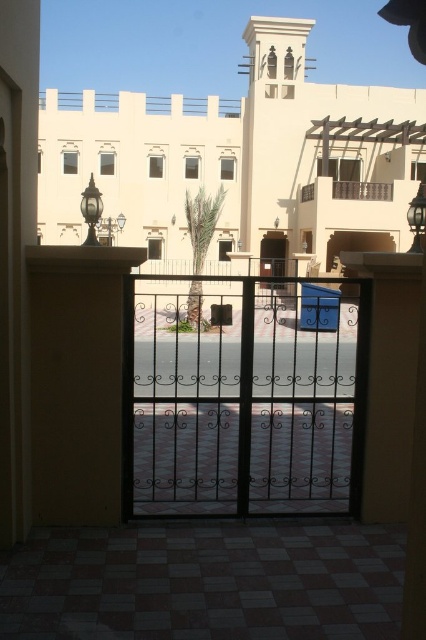
Question: Considering the real-world distances, which object is closest to the black wrought iron gate at center?

Choices:
 (A) clear glass screen door at center
 (B) wooden slats balcony at upper center

Answer: (B)

Question: Which object is closer to the camera taking this photo?

Choices:
 (A) clear glass screen door at center
 (B) wooden slats balcony at upper center
 (C) black wrought iron gate at center

Answer: (C)

Question: Which point appears farthest from the camera in this image?

Choices:
 (A) (388, 186)
 (B) (302, 404)

Answer: (A)

Question: Is black wrought iron gate at center closer to the viewer compared to clear glass screen door at center?

Choices:
 (A) no
 (B) yes

Answer: (B)

Question: Does black wrought iron gate at center have a smaller size compared to wooden slats balcony at upper center?

Choices:
 (A) yes
 (B) no

Answer: (B)

Question: Is wooden slats balcony at upper center to the left of clear glass screen door at center from the viewer's perspective?

Choices:
 (A) yes
 (B) no

Answer: (B)